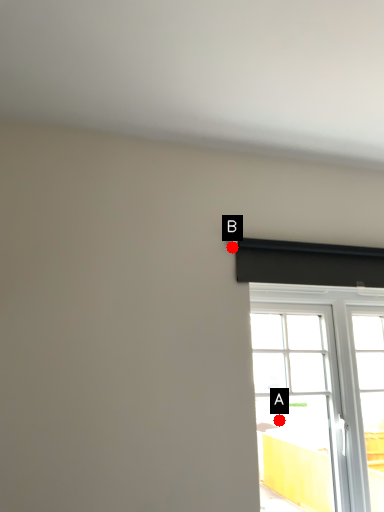
Question: Two points are circled on the image, labeled by A and B beside each circle. Which point is closer to the camera?

Choices:
 (A) A is closer
 (B) B is closer

Answer: (B)